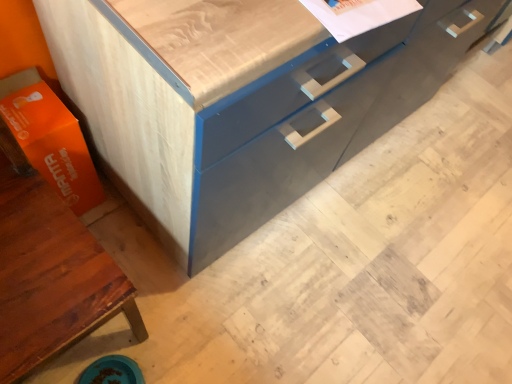
Find the location of a particular element. vacant area located to the right-hand side of matte wood cabinet at lower left is located at coordinates (195, 321).